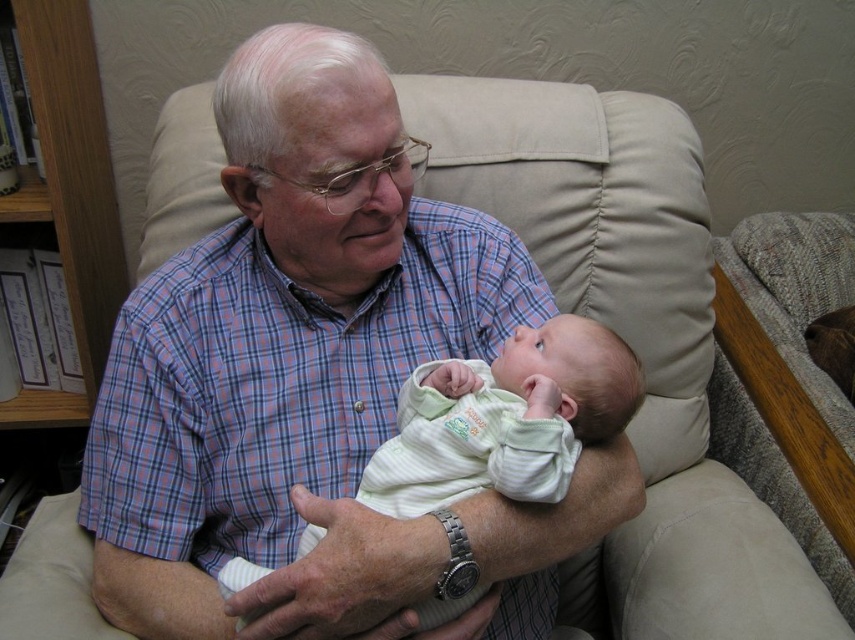
Question: Which of the following is the farthest from the observer?

Choices:
 (A) (623, 353)
 (B) (426, 237)
 (C) (111, 179)

Answer: (C)

Question: Can you confirm if plaid shirt at center is thinner than light green striped fabric baby at center?

Choices:
 (A) no
 (B) yes

Answer: (A)

Question: Which object is closer to the camera taking this photo?

Choices:
 (A) wooden bookshelf at left
 (B) light green striped fabric baby at center

Answer: (B)

Question: Among these objects, which one is farthest from the camera?

Choices:
 (A) light green striped fabric baby at center
 (B) wooden bookshelf at left

Answer: (B)

Question: Does plaid shirt at center lie in front of wooden bookshelf at left?

Choices:
 (A) no
 (B) yes

Answer: (B)

Question: Can you confirm if light green striped fabric baby at center is smaller than wooden bookshelf at left?

Choices:
 (A) yes
 (B) no

Answer: (A)